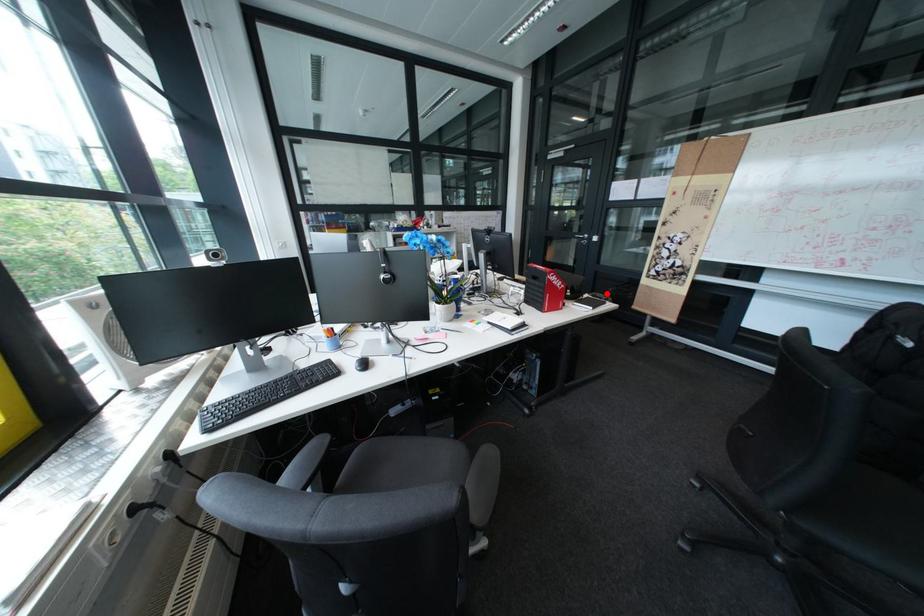
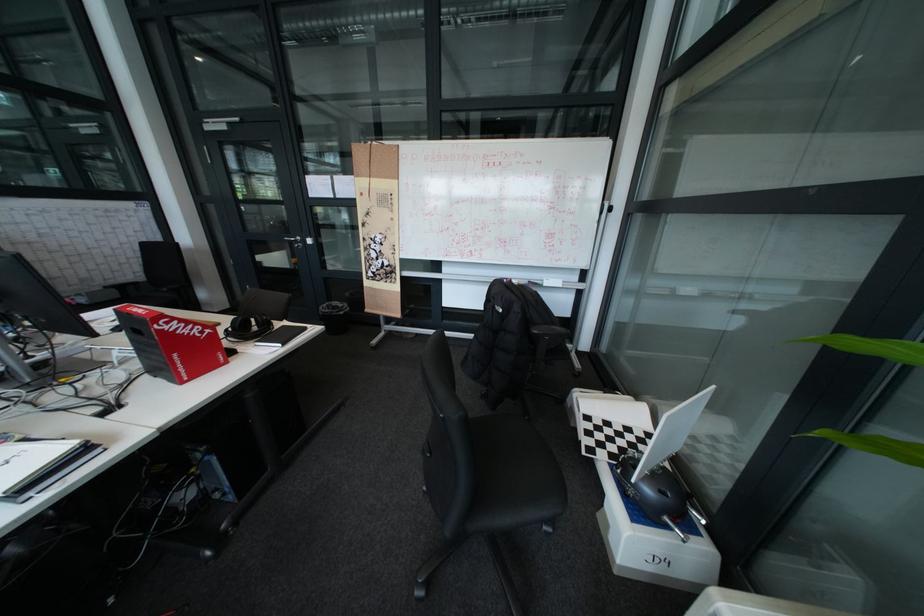
Question: I am providing you with two images of the same scene from different viewpoints. A red point is marked on the first image. Is the red point's position out of view in image 2?

Choices:
 (A) Yes
 (B) No

Answer: (B)